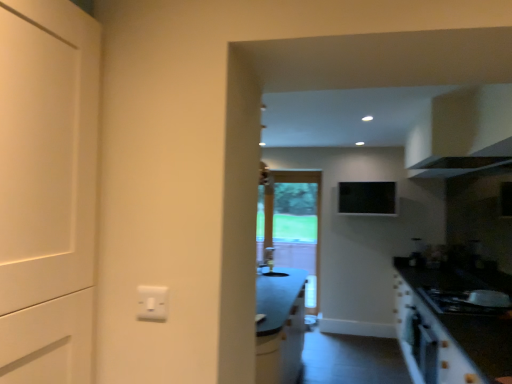
Question: Considering the relative positions of clear glass screen door at center and white glossy sink at center in the image provided, is clear glass screen door at center in front of white glossy sink at center?

Choices:
 (A) no
 (B) yes

Answer: (A)

Question: From a real-world perspective, does clear glass screen door at center stand above white glossy sink at center?

Choices:
 (A) yes
 (B) no

Answer: (A)

Question: From the image's perspective, is clear glass screen door at center located above white glossy sink at center?

Choices:
 (A) yes
 (B) no

Answer: (B)

Question: Is clear glass screen door at center next to white glossy sink at center?

Choices:
 (A) no
 (B) yes

Answer: (A)

Question: From a real-world perspective, is clear glass screen door at center positioned under white glossy sink at center based on gravity?

Choices:
 (A) yes
 (B) no

Answer: (B)

Question: Is point (468, 306) positioned closer to the camera than point (301, 206)?

Choices:
 (A) closer
 (B) farther

Answer: (A)

Question: Is black matte gas stove at lower right taller or shorter than clear glass screen door at center?

Choices:
 (A) tall
 (B) short

Answer: (B)

Question: From the image's perspective, is black matte gas stove at lower right above or below clear glass screen door at center?

Choices:
 (A) above
 (B) below

Answer: (B)

Question: Considering the relative positions of black matte gas stove at lower right and clear glass screen door at center in the image provided, is black matte gas stove at lower right to the left or to the right of clear glass screen door at center?

Choices:
 (A) right
 (B) left

Answer: (A)

Question: In the image, is clear glass screen door at center on the left side or the right side of white glossy cabinet at upper right?

Choices:
 (A) left
 (B) right

Answer: (A)

Question: In terms of width, does clear glass screen door at center look wider or thinner when compared to white glossy cabinet at upper right?

Choices:
 (A) thin
 (B) wide

Answer: (A)

Question: From the image's perspective, is clear glass screen door at center positioned above or below white glossy cabinet at upper right?

Choices:
 (A) below
 (B) above

Answer: (A)

Question: Does point (294, 185) appear closer or farther from the camera than point (493, 144)?

Choices:
 (A) closer
 (B) farther

Answer: (B)

Question: In terms of height, does white glossy cabinet at upper right look taller or shorter compared to clear glass screen door at center?

Choices:
 (A) short
 (B) tall

Answer: (A)

Question: Is white glossy cabinet at upper right in front of or behind clear glass screen door at center in the image?

Choices:
 (A) behind
 (B) front

Answer: (B)